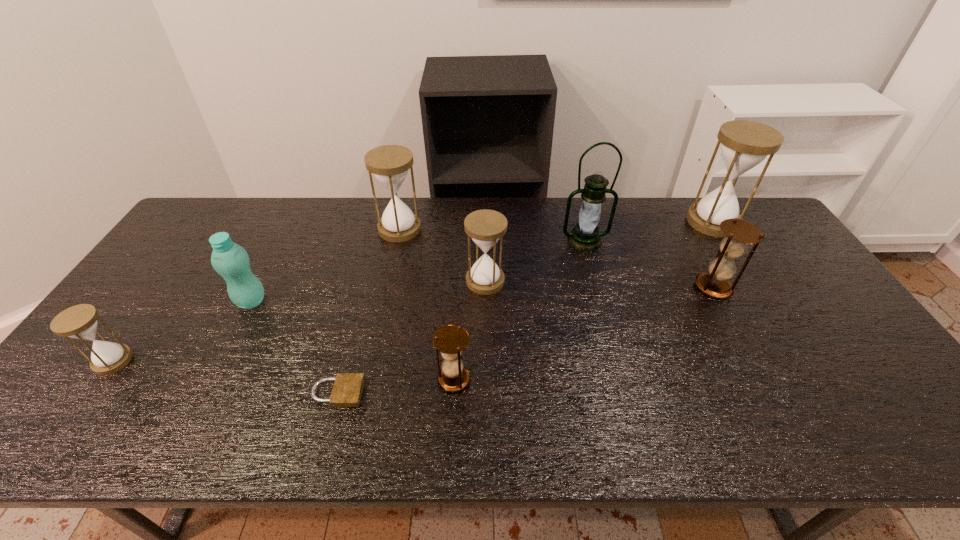
The width and height of the screenshot is (960, 540). Identify the location of vacant space at the near edge. (332, 442).

Locate an element on the screen. vacant space at the left edge of the desktop is located at coordinates (180, 279).

Locate an element on the screen. The height and width of the screenshot is (540, 960). free region at the right edge of the desktop is located at coordinates (801, 335).

Find the location of a particular element. vacant space at the near right corner of the desktop is located at coordinates (941, 442).

Find the location of a particular element. vacant space that is in between the shortest object and the green lantern is located at coordinates (462, 316).

I want to click on empty space between the third smallest white hourglass and the tallest hourglass, so click(x=556, y=225).

This screenshot has height=540, width=960. In order to click on vacant area that lies between the shortest object and the bottle in this screenshot , I will do `click(295, 347)`.

Identify the location of vacant area between the shortest object and the third white hourglass from left to right. The width and height of the screenshot is (960, 540). (412, 336).

The height and width of the screenshot is (540, 960). What are the coordinates of `vacant space in between the padlock and the third biggest white hourglass` in the screenshot? It's located at (412, 336).

In order to click on free space that is in between the right brown hourglass and the third farthest white hourglass in this screenshot , I will do `click(599, 284)`.